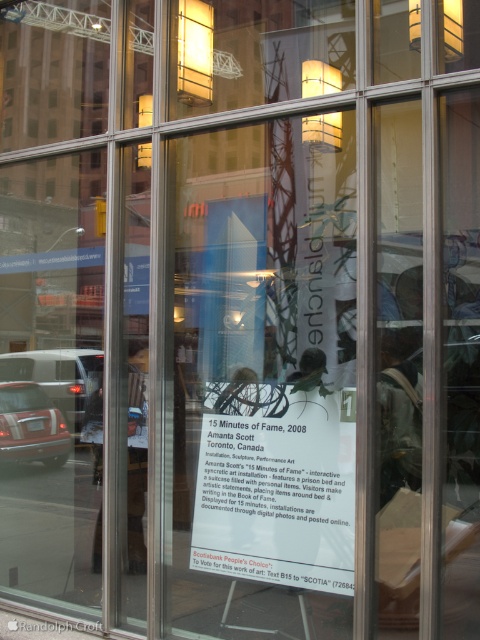
Question: Which object is positioned farthest from the white paper at center?

Choices:
 (A) matte black car at lower left
 (B) matte black car at left

Answer: (B)

Question: Among these objects, which one is nearest to the camera?

Choices:
 (A) matte black car at lower left
 (B) matte black car at left

Answer: (A)

Question: Can you confirm if white paper at center is positioned below matte black car at left?

Choices:
 (A) yes
 (B) no

Answer: (B)

Question: Where is white paper at center located in relation to matte black car at left in the image?

Choices:
 (A) left
 (B) right

Answer: (B)

Question: In this image, where is matte black car at left located relative to matte black car at lower left?

Choices:
 (A) below
 (B) above

Answer: (B)

Question: Which object is positioned farthest from the matte black car at left?

Choices:
 (A) matte black car at lower left
 (B) white paper at center

Answer: (B)